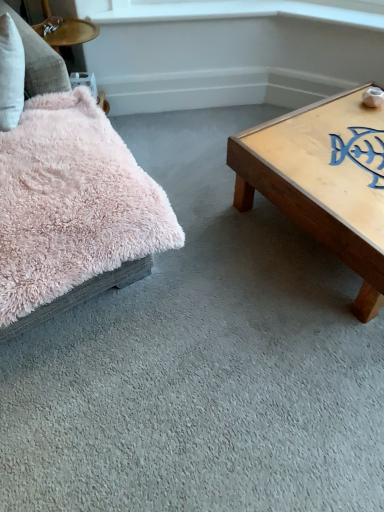
Where is `empty space that is ontop of light brown wooden coffee table at right (from a real-world perspective)`? This screenshot has width=384, height=512. empty space that is ontop of light brown wooden coffee table at right (from a real-world perspective) is located at coordinates (345, 153).